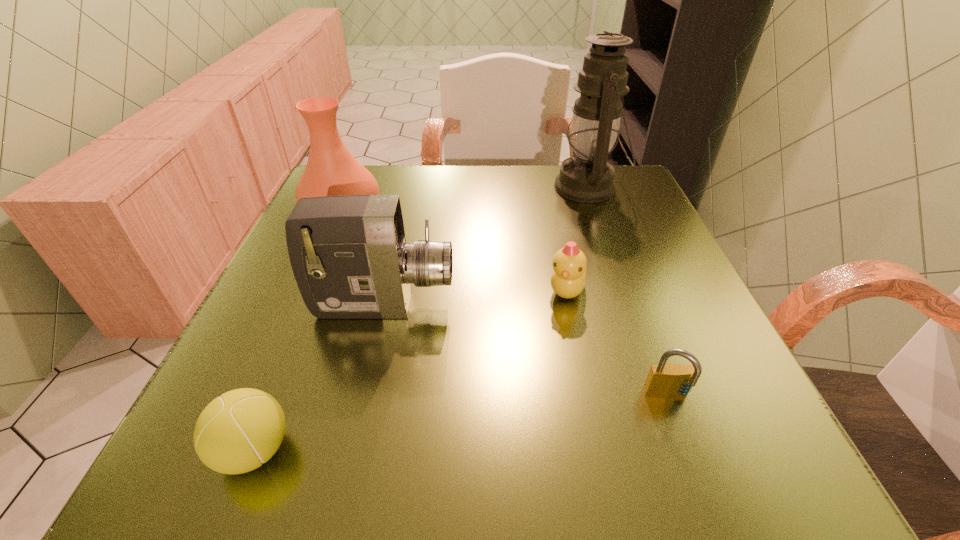
Where is `vacant region located on the back of the nearest object`? vacant region located on the back of the nearest object is located at coordinates (333, 257).

Where is `oil lamp located at the far edge`? The height and width of the screenshot is (540, 960). oil lamp located at the far edge is located at coordinates (587, 177).

At what (x,y) coordinates should I click in order to perform the action: click on vase positioned at the far edge. Please return your answer as a coordinate pair (x, y). The width and height of the screenshot is (960, 540). Looking at the image, I should click on (331, 170).

Locate an element on the screen. object at the near edge is located at coordinates (237, 432).

I want to click on vase at the left edge, so click(x=331, y=170).

At what (x,y) coordinates should I click in order to perform the action: click on camcorder positioned at the left edge. Please return your answer as a coordinate pair (x, y). Looking at the image, I should click on (349, 256).

Find the location of a particular element. This screenshot has width=960, height=540. tennis ball at the left edge is located at coordinates (237, 432).

Locate an element on the screen. The image size is (960, 540). oil lamp positioned at the right edge is located at coordinates (587, 177).

Find the location of a particular element. This screenshot has width=960, height=540. padlock at the right edge is located at coordinates pos(664,380).

The height and width of the screenshot is (540, 960). In order to click on object that is at the far left corner in this screenshot , I will do `click(331, 170)`.